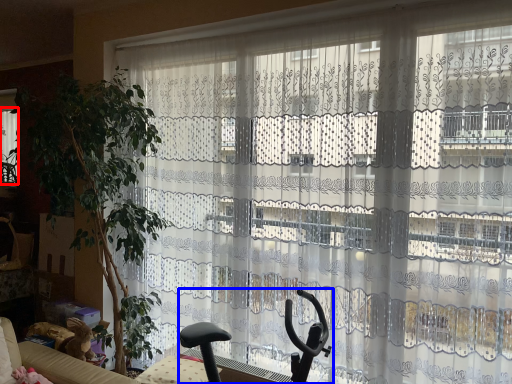
Question: Which of the following is the closest to the observer, window (highlighted by a red box) or swivel chair (highlighted by a blue box)?

Choices:
 (A) window
 (B) swivel chair

Answer: (B)